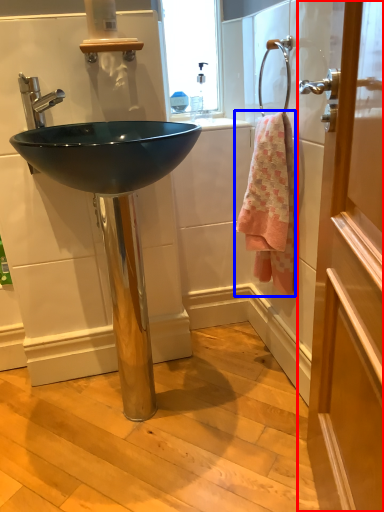
Question: Which object appears closest to the camera in this image, door (highlighted by a red box) or towel/napkin (highlighted by a blue box)?

Choices:
 (A) door
 (B) towel/napkin

Answer: (A)